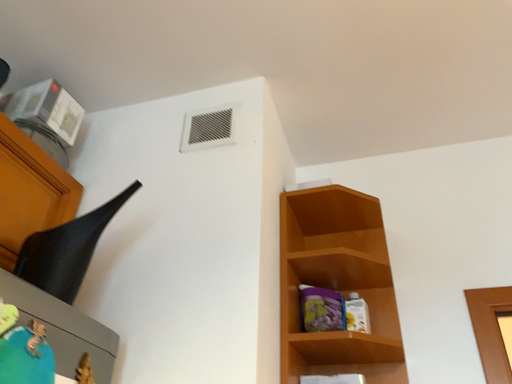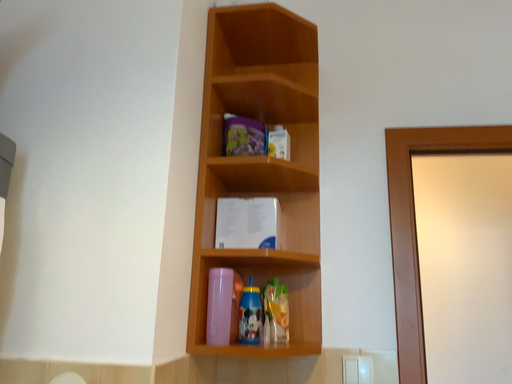
Question: Which way did the camera rotate in the video?

Choices:
 (A) rotated left
 (B) rotated right

Answer: (B)